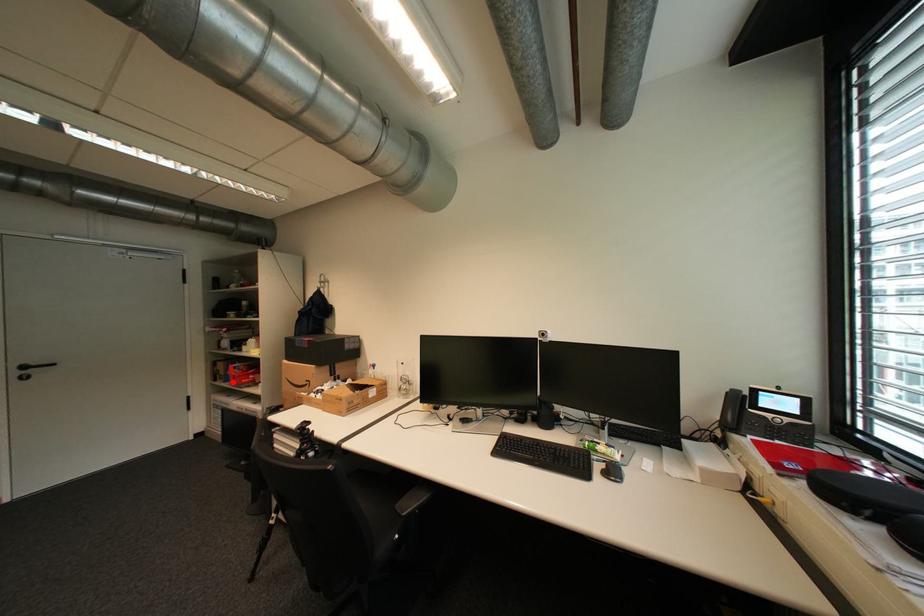
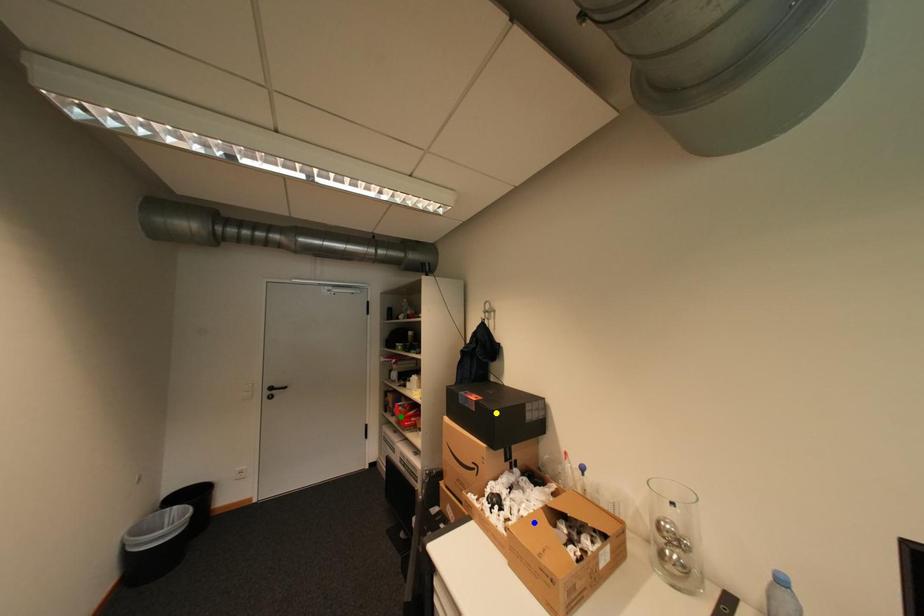
Question: I am providing you with two images of the same scene from different viewpoints. A red point is marked on the first image. You are given multiple points on the second image. Which mark in image 2 goes with the point in image 1?

Choices:
 (A) green point
 (B) yellow point
 (C) blue point

Answer: (A)